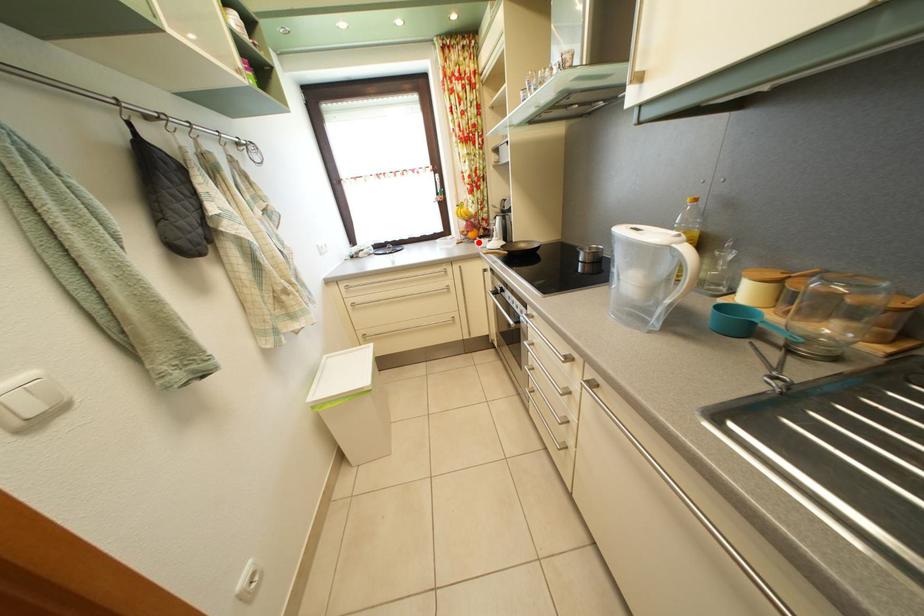
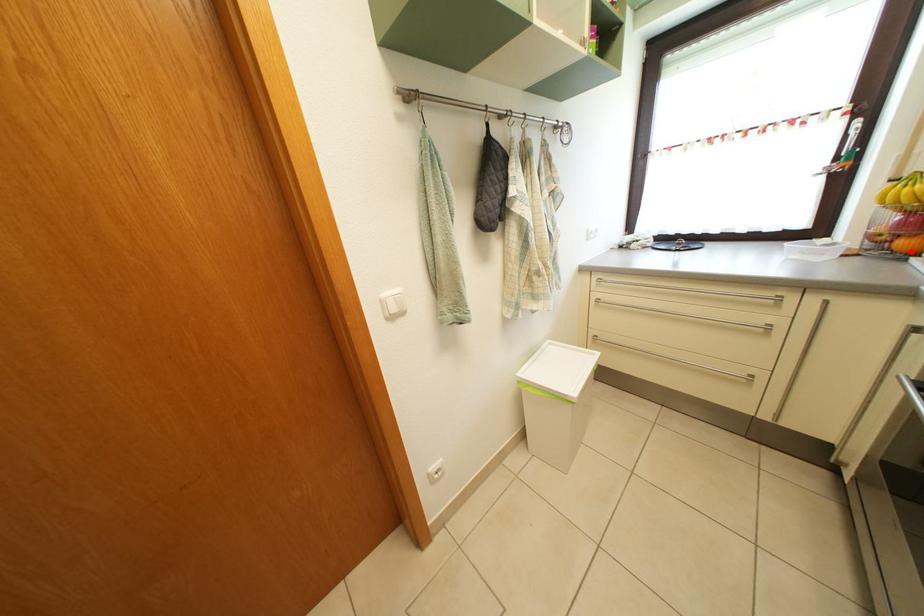
From the picture: I am providing you with two images of the same scene from different viewpoints. A red point is marked on the first image and another point is marked on the second image. Is the marked point in image1 the same physical position as the marked point in image2?

Yes